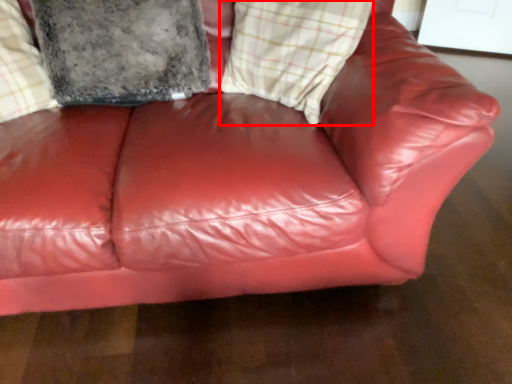
Question: Where is plaid (annotated by the red box) located in relation to pillow in the image?

Choices:
 (A) right
 (B) left

Answer: (A)